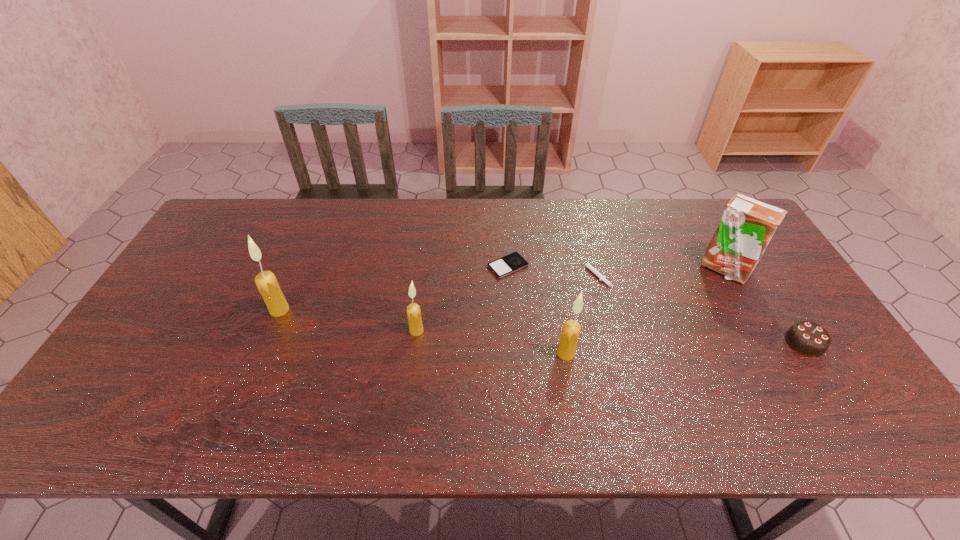
Locate an element on the screen. The image size is (960, 540). the sixth tallest object is located at coordinates point(591,268).

Where is `syringe`? The height and width of the screenshot is (540, 960). syringe is located at coordinates (591, 268).

Identify the location of free space located 0.330m on the back of the leftmost candle. (314, 230).

Find the location of `free space located 0.230m on the left of the sixth object from right to left`. free space located 0.230m on the left of the sixth object from right to left is located at coordinates (324, 330).

Find the location of a particular element. Image resolution: width=960 pixels, height=540 pixels. free space located on the back of the fourth object from left to right is located at coordinates (559, 311).

You are a GUI agent. You are given a task and a screenshot of the screen. Output one action in this format:
    pyautogui.click(x=<x>, y=<y>)
    Task: Click on the vacant region located on the straw side of the carton
    The width and height of the screenshot is (960, 540).
    Given the screenshot: What is the action you would take?
    pyautogui.click(x=756, y=326)

Identify the location of free space located on the left of the shortest object. (416, 266).

Find the location of a particular element. The image size is (960, 540). vacant region located on the back of the chocolate cake is located at coordinates (757, 269).

This screenshot has width=960, height=540. Identify the location of free location located 0.400m on the left of the second shortest object. (450, 273).

The height and width of the screenshot is (540, 960). In order to click on carton present at the right edge in this screenshot , I will do `click(747, 225)`.